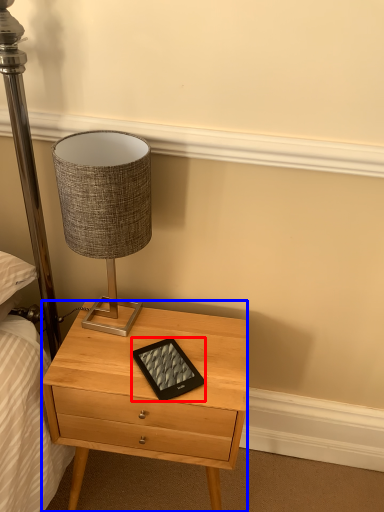
Question: Which object is further to the camera taking this photo, tablet computer (highlighted by a red box) or nightstand (highlighted by a blue box)?

Choices:
 (A) tablet computer
 (B) nightstand

Answer: (A)